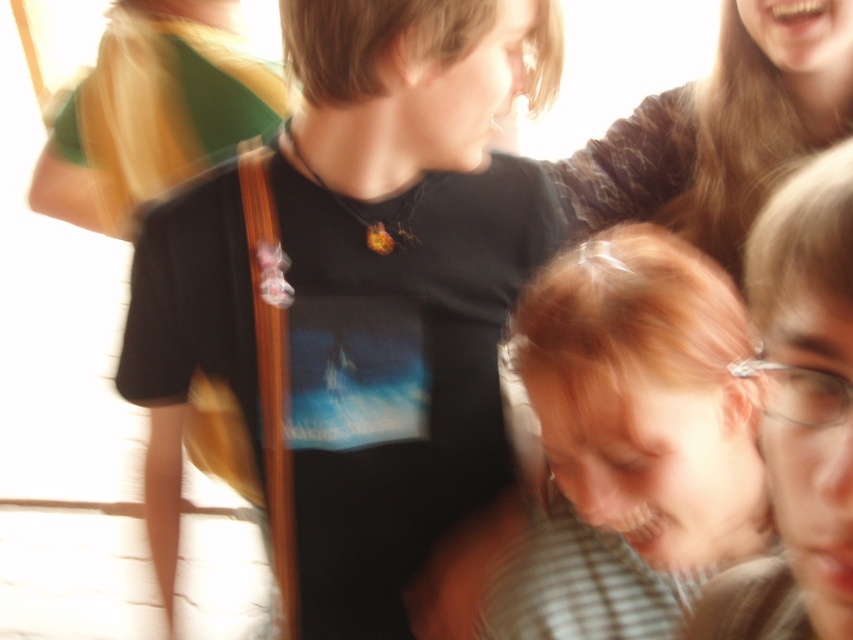
You are a photographer standing at the scene. You want to take a clearer photo of the blonde hair at lower right. Given that your camera can focus on objects within 20 inches, will you need to move closer or further away?

The blonde hair at lower right is 23.72 inches away from the viewer. Since your camera can focus within 20 inches, you need to move closer to bring it within the focus range.